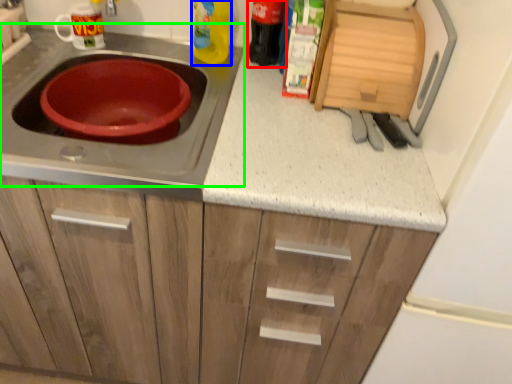
Question: Based on their relative distances, which object is nearer to bottle (highlighted by a red box)? Choose from bottle (highlighted by a blue box) and gas stove (highlighted by a green box).

Choices:
 (A) bottle
 (B) gas stove

Answer: (A)